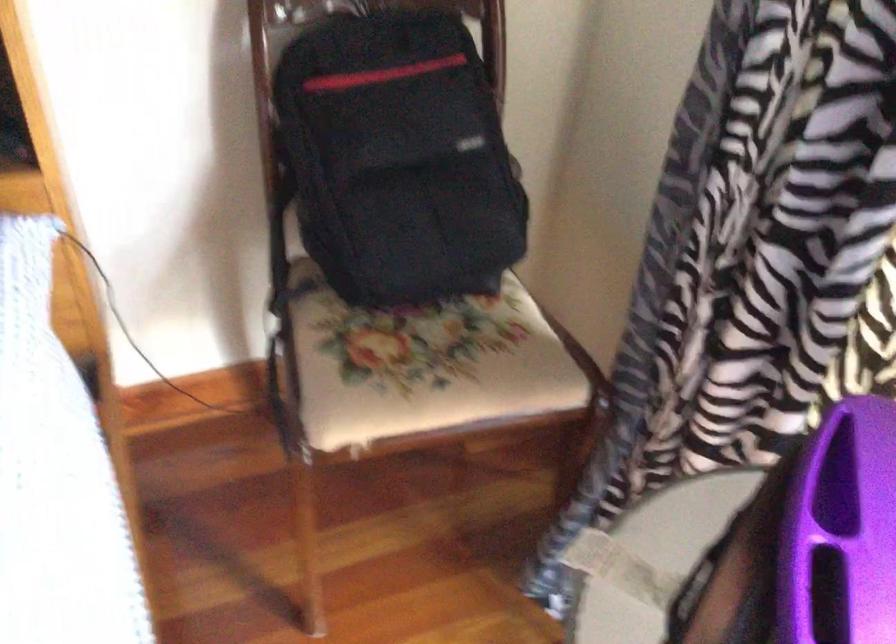
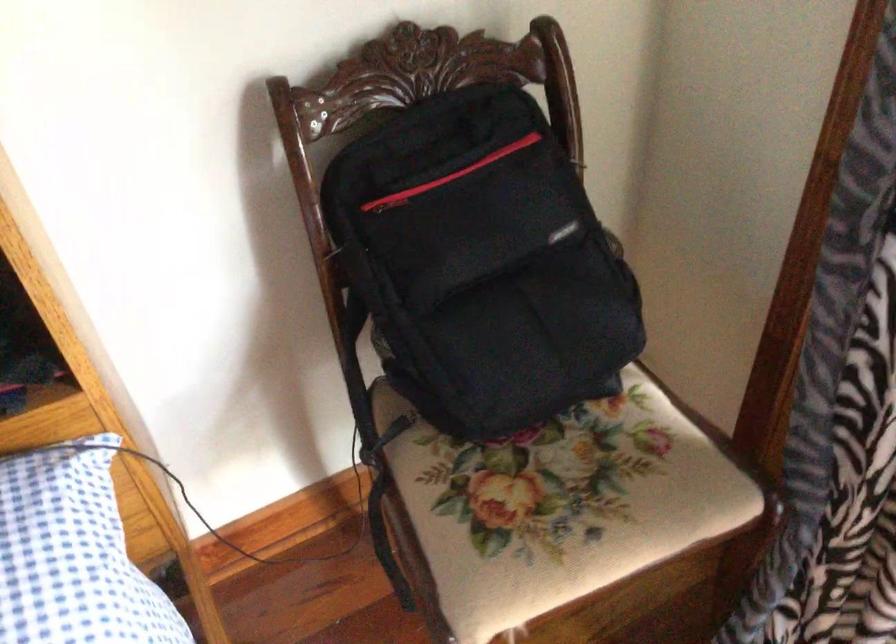
The images are taken continuously from a first-person perspective. In which direction are you moving?

The cameraman walked toward left, forward.